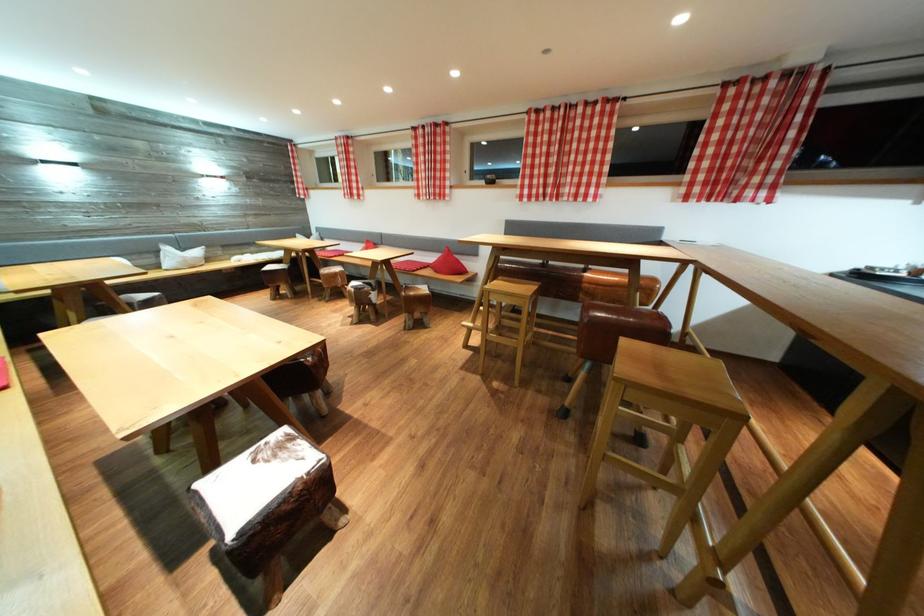
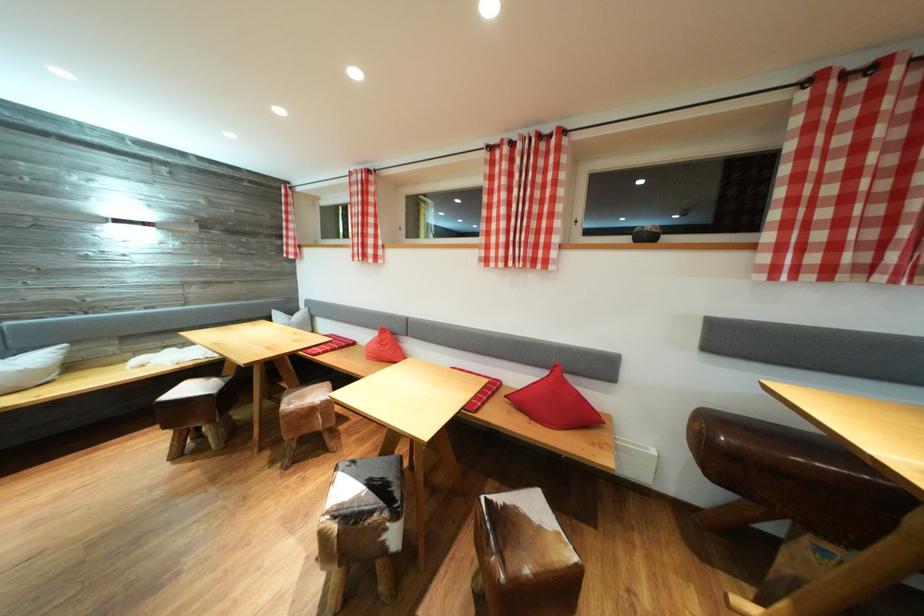
Locate, in the second image, the point that corresponds to point (381, 296) in the first image.

(403, 522)